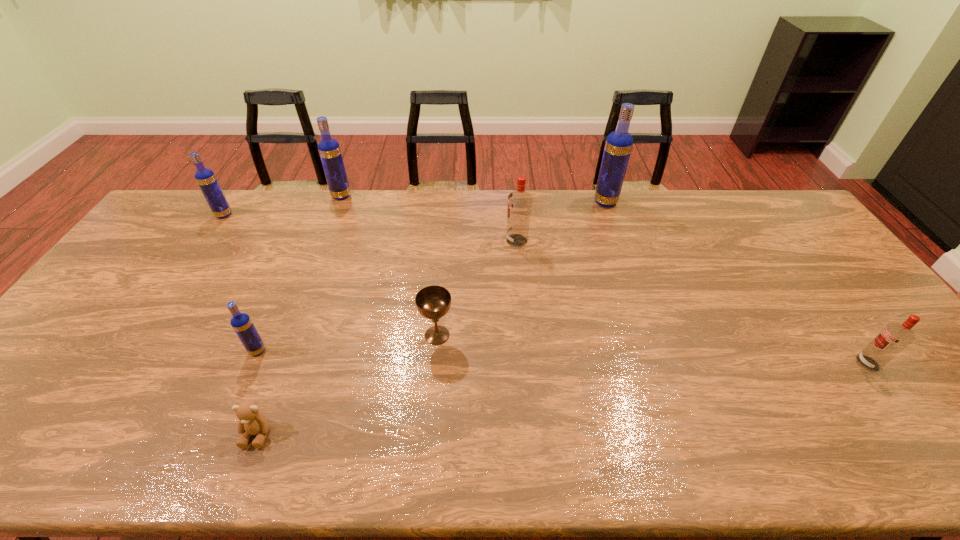
Identify the location of the rightmost blue vodka. This screenshot has height=540, width=960. 619,143.

Locate an element on the screen. the biggest blue vodka is located at coordinates (619, 143).

Locate an element on the screen. the second blue vodka from right to left is located at coordinates (329, 150).

Identify the location of the fifth shortest vodka. This screenshot has height=540, width=960. (329, 150).

Image resolution: width=960 pixels, height=540 pixels. Find the location of `the third farthest blue vodka`. the third farthest blue vodka is located at coordinates (205, 177).

Where is `the leftmost blue vodka`? the leftmost blue vodka is located at coordinates (205, 177).

You are a GUI agent. You are given a task and a screenshot of the screen. Output one action in this format:
    pyautogui.click(x=<x>, y=<y>)
    Task: Click on the fourth farthest object
    The width and height of the screenshot is (960, 540).
    Given the screenshot: What is the action you would take?
    pyautogui.click(x=519, y=201)

Find the location of `the left red vodka`. the left red vodka is located at coordinates point(519,201).

This screenshot has height=540, width=960. I want to click on the rightmost vodka, so click(894, 337).

At what (x,y) coordinates should I click in order to perform the action: click on the smaller red vodka. Please return your answer as a coordinate pair (x, y). The height and width of the screenshot is (540, 960). Looking at the image, I should click on (894, 337).